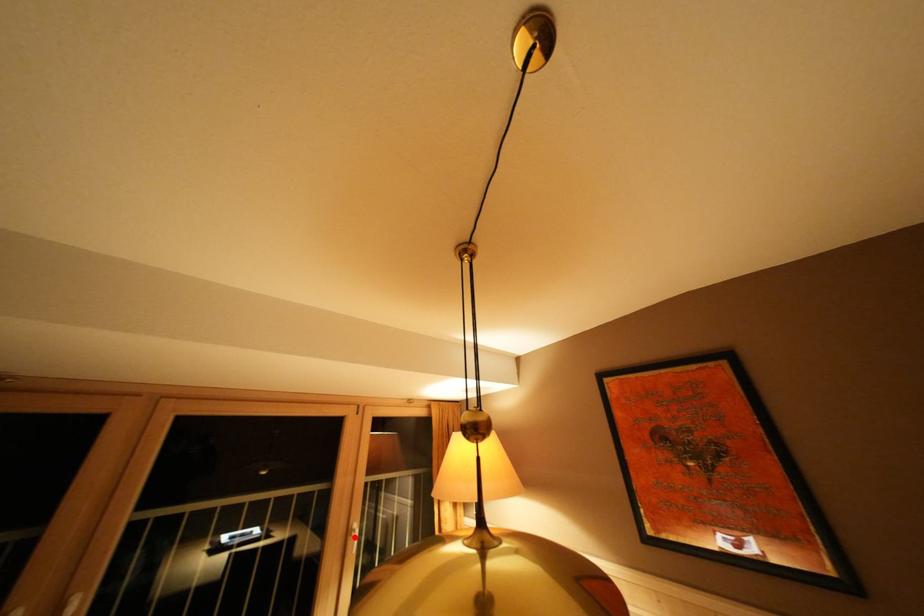
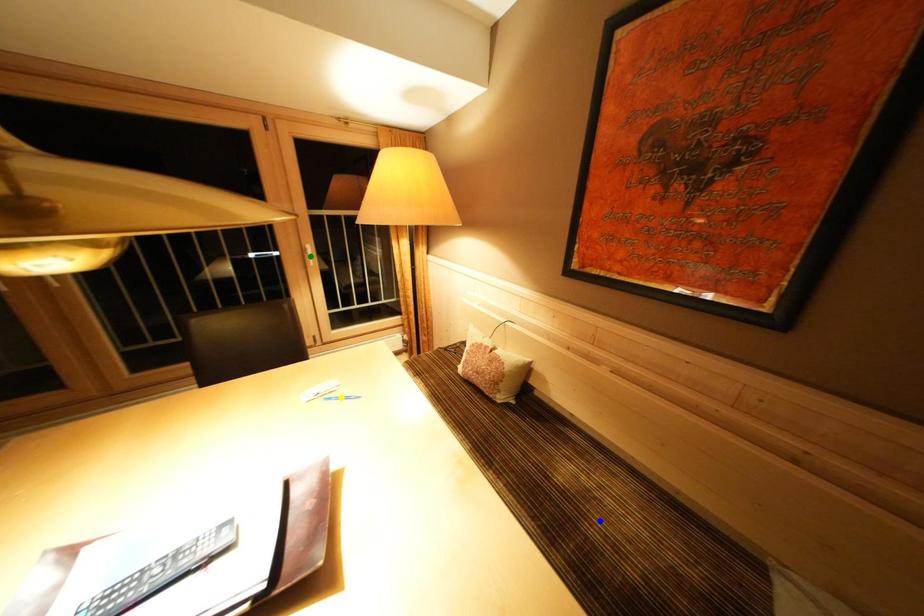
Question: I am providing you with two images of the same scene from different viewpoints. A red point is marked on the first image. You are given multiple points on the second image. Which point in image 2 represents the same 3d spot as the red point in image 1?

Choices:
 (A) blue point
 (B) green point
 (C) yellow point

Answer: (B)